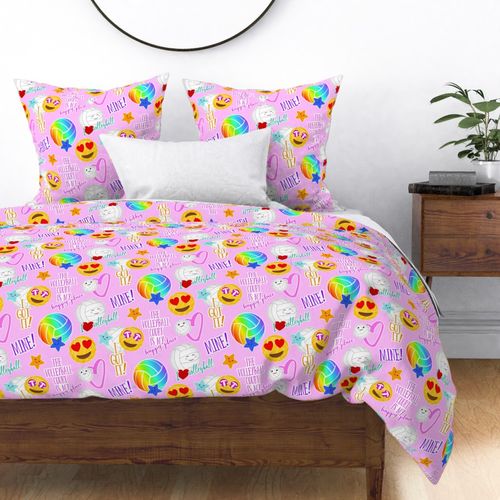
Locate an element on the screen. wooden bed frame is located at coordinates (117, 442).